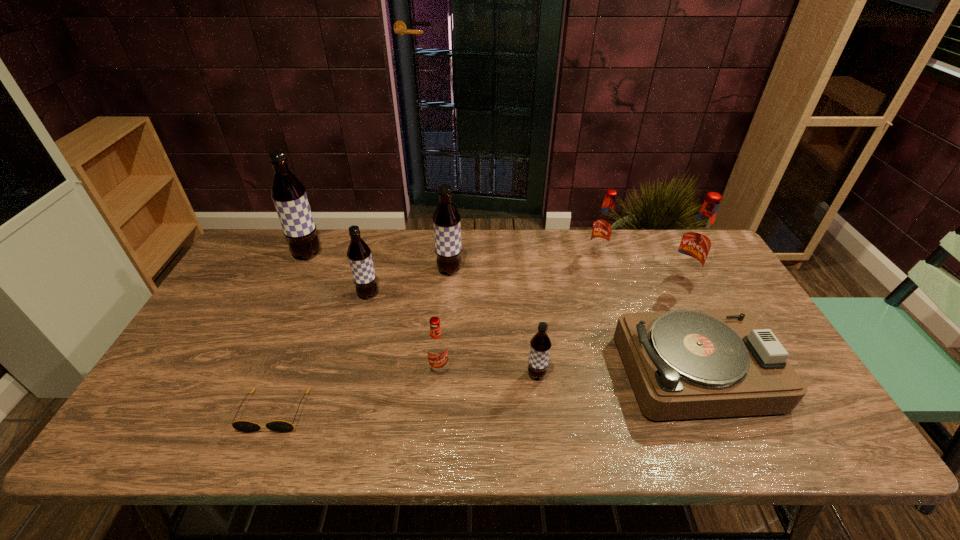
This screenshot has width=960, height=540. I want to click on vacant space situated 0.360m on the front of the farthest red root beer, so click(627, 346).

Locate an element on the screen. The width and height of the screenshot is (960, 540). free space located 0.150m on the right of the smallest red root beer is located at coordinates point(509,369).

Locate an element on the screen. The height and width of the screenshot is (540, 960). vacant area located 0.210m on the back of the rightmost brown root beer is located at coordinates (529, 308).

The height and width of the screenshot is (540, 960). In order to click on free space located 0.170m on the back of the eighth tallest object in this screenshot , I will do `click(661, 288)`.

Identify the location of record player present at the near edge. Image resolution: width=960 pixels, height=540 pixels. (687, 364).

The height and width of the screenshot is (540, 960). Find the location of `sunglasses positioned at the near edge`. sunglasses positioned at the near edge is located at coordinates (242, 426).

Locate an element on the screen. The image size is (960, 540). object at the left edge is located at coordinates (289, 196).

Identify the location of root beer located at the right edge. (x=696, y=242).

The width and height of the screenshot is (960, 540). In order to click on record player located at the right edge in this screenshot , I will do [687, 364].

Where is `object situated at the far left corner`? The height and width of the screenshot is (540, 960). object situated at the far left corner is located at coordinates (289, 196).